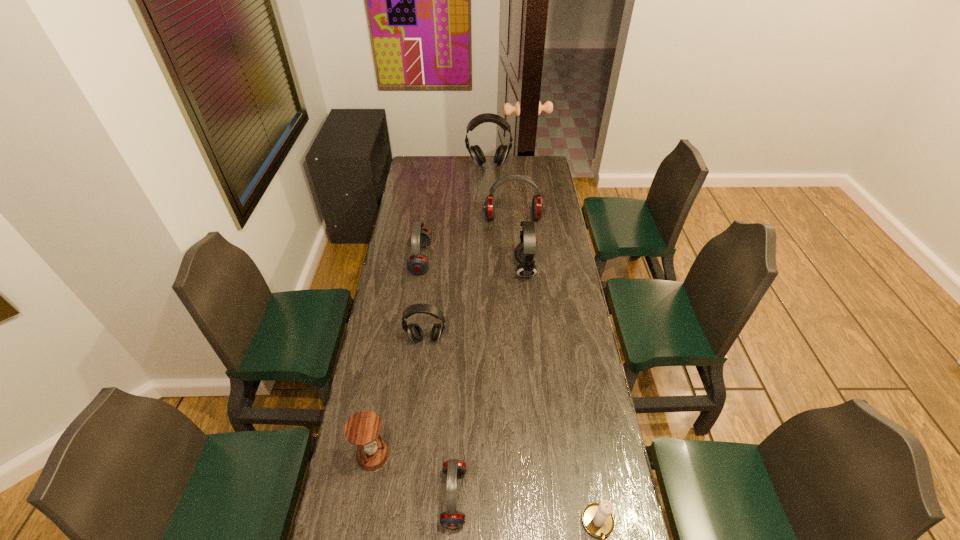
You are a GUI agent. You are given a task and a screenshot of the screen. Output one action in this format:
    pyautogui.click(x=<x>, y=<y>)
    Task: Click on the nearest red earphone
    The width and height of the screenshot is (960, 540).
    Given the screenshot: What is the action you would take?
    pyautogui.click(x=451, y=518)

Image resolution: width=960 pixels, height=540 pixels. I want to click on the shortest earphone, so 451,518.

Identify the location of free space located on the ear cups of the biggest black earphone. click(x=490, y=199).

The width and height of the screenshot is (960, 540). In order to click on vacant space situated on the ear cups of the biggest red earphone in this screenshot , I will do `click(517, 264)`.

At what (x,y) coordinates should I click in order to perform the action: click on vacant space situated on the ear cups of the second biggest black earphone. Please return your answer as a coordinate pair (x, y). Looking at the image, I should click on (501, 269).

At what (x,y) coordinates should I click in order to perform the action: click on free space located 0.170m on the ear cups of the second biggest black earphone. Please return your answer as a coordinate pair (x, y). This screenshot has width=960, height=540. Looking at the image, I should click on (476, 269).

At what (x,y) coordinates should I click in order to perform the action: click on vacant area located 0.050m on the ear cups of the second biggest black earphone. Please return your answer as a coordinate pair (x, y). The height and width of the screenshot is (540, 960). Looking at the image, I should click on (503, 269).

The image size is (960, 540). Identify the location of free space located 0.270m on the ear cups of the second smallest red earphone. (491, 259).

The width and height of the screenshot is (960, 540). In order to click on free space located on the ear cups of the nearest black earphone in this screenshot , I will do `click(415, 444)`.

Identify the location of free spot located 0.110m on the front of the hourglass. (364, 510).